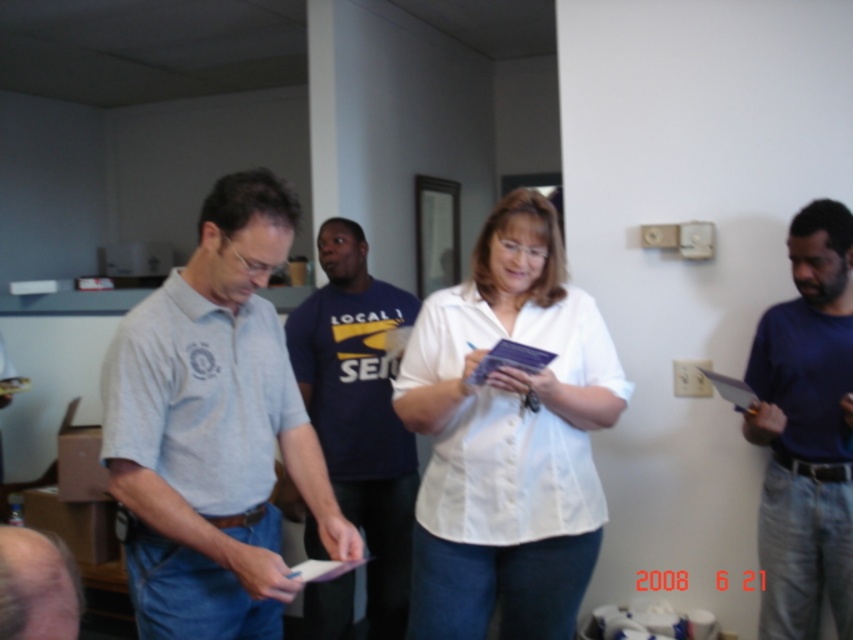
Looking at this image, does light gray cotton shirt at center have a greater width compared to blue cotton shirt at right?

Indeed, light gray cotton shirt at center has a greater width compared to blue cotton shirt at right.

Who is positioned more to the left, light gray cotton shirt at center or blue cotton shirt at right?

Positioned to the left is light gray cotton shirt at center.

This screenshot has height=640, width=853. Find the location of `light gray cotton shirt at center`. light gray cotton shirt at center is located at coordinates (213, 428).

This screenshot has width=853, height=640. Find the location of `light gray cotton shirt at center`. light gray cotton shirt at center is located at coordinates [x=213, y=428].

Between point (795, 595) and point (25, 560), which one is positioned in front?

Point (25, 560) is in front.

Between blue cotton shirt at right and smooth skin head at lower left, which one is positioned lower?

blue cotton shirt at right is below.

Who is more forward, (851,372) or (3,592)?

Point (3,592) is in front.

Where is `blue cotton shirt at right`? This screenshot has width=853, height=640. blue cotton shirt at right is located at coordinates (805, 429).

Is point (451, 614) behind point (38, 616)?

Yes, it is behind point (38, 616).

Is point (469, 573) positioned before point (3, 604)?

That is False.

Identify the location of white matte shirt at center. (508, 436).